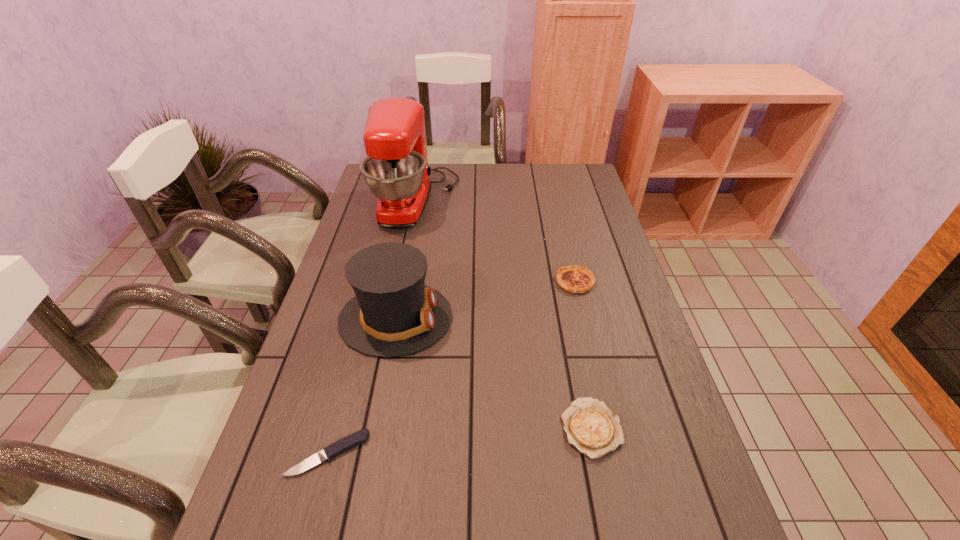
In the image, there is a desktop. Where is `vacant space at the far right corner`? The image size is (960, 540). vacant space at the far right corner is located at coordinates (564, 174).

This screenshot has height=540, width=960. I want to click on free space between the shorter quiche and the second tallest object, so click(x=493, y=373).

Where is `free spot between the shorter quiche and the kitchen mixer`? Image resolution: width=960 pixels, height=540 pixels. free spot between the shorter quiche and the kitchen mixer is located at coordinates (504, 314).

Locate an element on the screen. free area in between the farther quiche and the second tallest object is located at coordinates (486, 300).

Locate an element on the screen. vacant region between the shorter quiche and the kitchen mixer is located at coordinates (504, 314).

Find the location of `blank region between the dress hat and the steak knife`. blank region between the dress hat and the steak knife is located at coordinates (362, 386).

Identify the location of vacant area that lies between the third shortest object and the fourth shortest object. (486, 300).

The width and height of the screenshot is (960, 540). What are the coordinates of `empty space that is in between the farther quiche and the farthest object` in the screenshot? It's located at (495, 241).

At what (x,y) coordinates should I click in order to perform the action: click on object that is the fourth closest to the tallest object. Please return your answer as a coordinate pair (x, y). Looking at the image, I should click on (361, 436).

Where is `the third closest object to the farther quiche`? This screenshot has height=540, width=960. the third closest object to the farther quiche is located at coordinates coord(396,170).